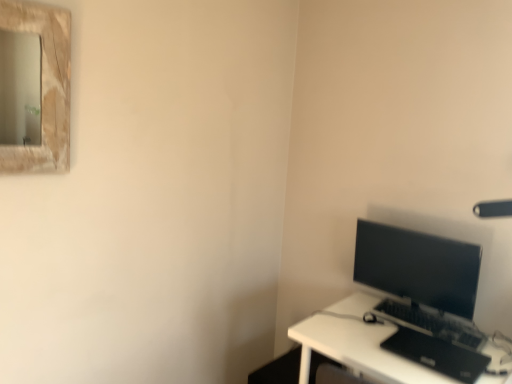
Find the location of a particular element. vacant space situated on the left part of black matte laptop at lower right is located at coordinates (368, 344).